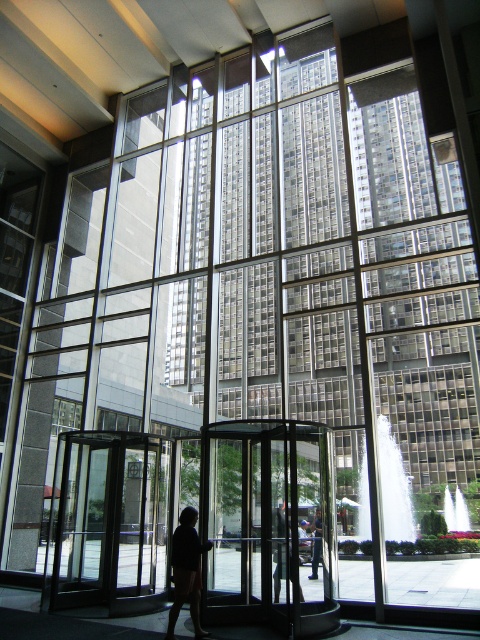
Based on the photo, you are standing in front of the revolving door and want to determine which of the two points, point (x=277, y=593) or point (x=317, y=545), is closer to you. Based on the scene description, which point is nearer?

Point (x=277, y=593) is closer to the camera than point (x=317, y=545), so it is the nearer point.

You are standing in front of the revolving door and want to reach the point marked at coordinates point (88, 470). Given that the revolving door is 10 meters wide, can you walk through the revolving door to reach that point?

The point (88, 470) is 10.90 meters from the viewer, which is beyond the 10 meters width of the revolving door. Therefore, you cannot walk through the revolving door to reach that point.